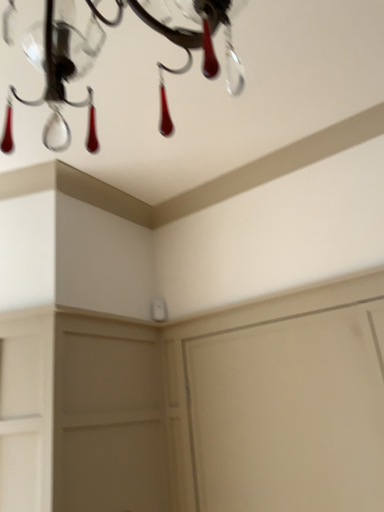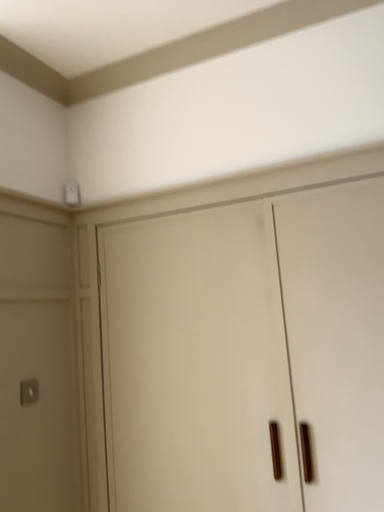
Question: How did the camera likely rotate when shooting the video?

Choices:
 (A) rotated right
 (B) rotated left

Answer: (A)